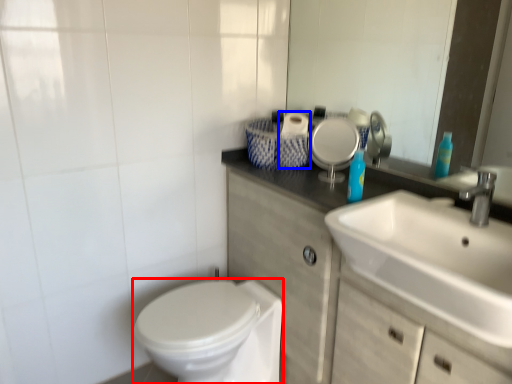
Question: Which of the following is the closest to the observer, bidet (highlighted by a red box) or toilet paper (highlighted by a blue box)?

Choices:
 (A) bidet
 (B) toilet paper

Answer: (A)